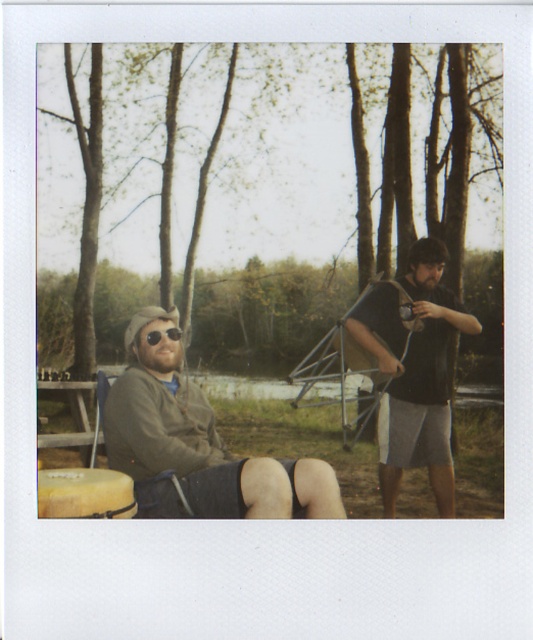
Question: Based on their relative distances, which object is farther from the matte black shirt at right?

Choices:
 (A) matte gray jacket at left
 (B) matte black goggles at center

Answer: (B)

Question: Which object is closer to the camera taking this photo?

Choices:
 (A) wooden picnic table at lower left
 (B) matte black shirt at right

Answer: (B)

Question: Is matte gray jacket at left above matte black shirt at right?

Choices:
 (A) no
 (B) yes

Answer: (A)

Question: Considering the real-world distances, which object is closest to the matte black shirt at right?

Choices:
 (A) matte black goggles at center
 (B) wooden picnic table at lower left
 (C) matte gray jacket at left

Answer: (C)

Question: Is matte black shirt at right thinner than matte black goggles at center?

Choices:
 (A) yes
 (B) no

Answer: (B)

Question: Does matte gray jacket at left have a greater width compared to matte black goggles at center?

Choices:
 (A) yes
 (B) no

Answer: (A)